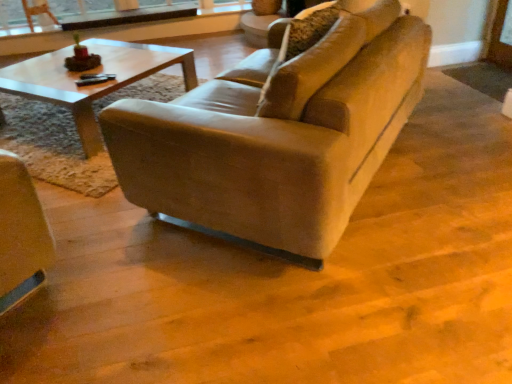
What is the approximate height of leather couch at center?

leather couch at center is 28.48 inches tall.

Identify the location of clear glass window frame at upper center. The height and width of the screenshot is (384, 512). [x=24, y=26].

Which object is positioned more to the right, leather couch at center or clear glass window frame at upper center?

From the viewer's perspective, leather couch at center appears more on the right side.

Is point (221, 94) closer to camera compared to point (3, 36)?

Yes, point (221, 94) is in front of point (3, 36).

Between leather couch at center and clear glass window frame at upper center, which one has smaller size?

clear glass window frame at upper center.

From a real-world perspective, between leather couch at center and clear glass window frame at upper center, who is vertically lower?

In real-world perspective, clear glass window frame at upper center is lower.

Looking at the image, does clear glass window frame at upper center seem bigger or smaller compared to leather couch at center?

clear glass window frame at upper center is smaller than leather couch at center.

Which object is positioned more to the right, clear glass window frame at upper center or leather couch at center?

From the viewer's perspective, leather couch at center appears more on the right side.

Is clear glass window frame at upper center spatially inside leather couch at center, or outside of it?

The correct answer is: outside.

Is leather couch at center turned away from matte brown armchair at upper left?

No, matte brown armchair at upper left is not at the back of leather couch at center.

From a real-world perspective, is leather couch at center below matte brown armchair at upper left?

No, from a real-world perspective, leather couch at center is not below matte brown armchair at upper left.

Considering the sizes of objects leather couch at center and matte brown armchair at upper left in the image provided, who is thinner, leather couch at center or matte brown armchair at upper left?

With smaller width is matte brown armchair at upper left.

From a real-world perspective, is clear glass window frame at upper center positioned above or below matte brown armchair at upper left?

clear glass window frame at upper center is below matte brown armchair at upper left.

Is clear glass window frame at upper center in front of matte brown armchair at upper left?

No, clear glass window frame at upper center is further to the viewer.

Is clear glass window frame at upper center to the right of matte brown armchair at upper left from the viewer's perspective?

Yes.

Which is closer to the camera, (38, 31) or (40, 9)?

The point (38, 31) is closer to the camera.

Is matte brown armchair at upper left completely or partially outside of clear glass window frame at upper center?

Absolutely, matte brown armchair at upper left is external to clear glass window frame at upper center.

Considering the relative sizes of matte brown armchair at upper left and clear glass window frame at upper center in the image provided, is matte brown armchair at upper left wider than clear glass window frame at upper center?

Incorrect, the width of matte brown armchair at upper left does not surpass that of clear glass window frame at upper center.

Which of these two, matte brown armchair at upper left or clear glass window frame at upper center, is smaller?

matte brown armchair at upper left is smaller.

Are matte brown armchair at upper left and clear glass window frame at upper center far apart?

matte brown armchair at upper left is near clear glass window frame at upper center, not far away.

In the scene shown: Considering the relative positions of matte brown armchair at upper left and leather couch at center in the image provided, is matte brown armchair at upper left behind leather couch at center?

That is True.

Is matte brown armchair at upper left with leather couch at center?

No, matte brown armchair at upper left is not beside leather couch at center.

From the image's perspective, between matte brown armchair at upper left and leather couch at center, who is located below?

leather couch at center is shown below in the image.

Image resolution: width=512 pixels, height=384 pixels. Find the location of `window frame directly beneath the leather couch at center (from a real-world perspective)`. window frame directly beneath the leather couch at center (from a real-world perspective) is located at coordinates (24, 26).

Where is `studio couch below the clear glass window frame at upper center (from the image's perspective)`? This screenshot has height=384, width=512. studio couch below the clear glass window frame at upper center (from the image's perspective) is located at coordinates (278, 134).

Which object lies further to the anchor point leather couch at center, clear glass window frame at upper center or matte brown armchair at upper left?

matte brown armchair at upper left lies further to leather couch at center than the other object.

Estimate the real-world distances between objects in this image. Which object is closer to clear glass window frame at upper center, leather couch at center or matte brown armchair at upper left?

matte brown armchair at upper left lies closer to clear glass window frame at upper center than the other object.

Which object lies nearer to the anchor point matte brown armchair at upper left, clear glass window frame at upper center or leather couch at center?

clear glass window frame at upper center is closer to matte brown armchair at upper left.

From the image, which object appears to be farther from matte brown armchair at upper left, leather couch at center or clear glass window frame at upper center?

Based on the image, leather couch at center appears to be further to matte brown armchair at upper left.

Based on their spatial positions, is matte brown armchair at upper left or leather couch at center closer to clear glass window frame at upper center?

matte brown armchair at upper left.

Which object lies nearer to the anchor point leather couch at center, matte brown armchair at upper left or clear glass window frame at upper center?

Based on the image, clear glass window frame at upper center appears to be nearer to leather couch at center.

I want to click on armchair between leather couch at center and clear glass window frame at upper center in the front-back direction, so click(37, 13).